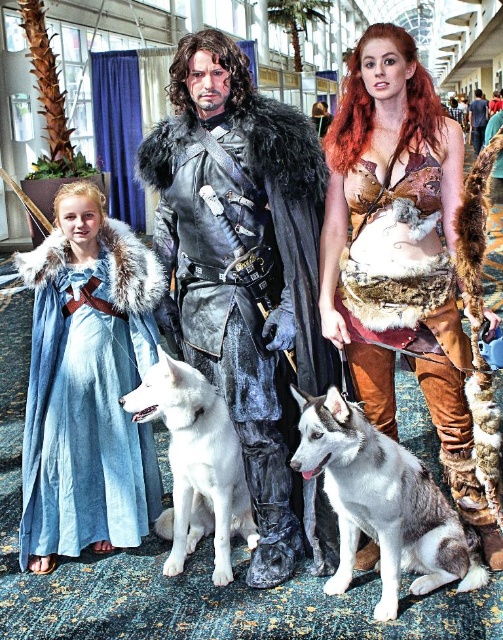
Question: Based on their relative distances, which object is farther from the gray-white fur dog at center?

Choices:
 (A) shiny silver armor at center
 (B) shiny fur vest at center

Answer: (A)

Question: Is leather fur-trimmed armor at center behind shiny silver armor at center?

Choices:
 (A) yes
 (B) no

Answer: (B)

Question: Is gray-white fur dog at center above shiny silver armor at center?

Choices:
 (A) yes
 (B) no

Answer: (B)

Question: Does shiny fur vest at center have a larger size compared to gray-white fur dog at center?

Choices:
 (A) no
 (B) yes

Answer: (B)

Question: Which point is closer to the camera?

Choices:
 (A) (460, 557)
 (B) (479, 92)
 (C) (460, 461)
 (D) (110, 458)

Answer: (A)

Question: Which point is farther from the camera taking this photo?

Choices:
 (A) click(x=303, y=419)
 (B) click(x=141, y=388)

Answer: (B)